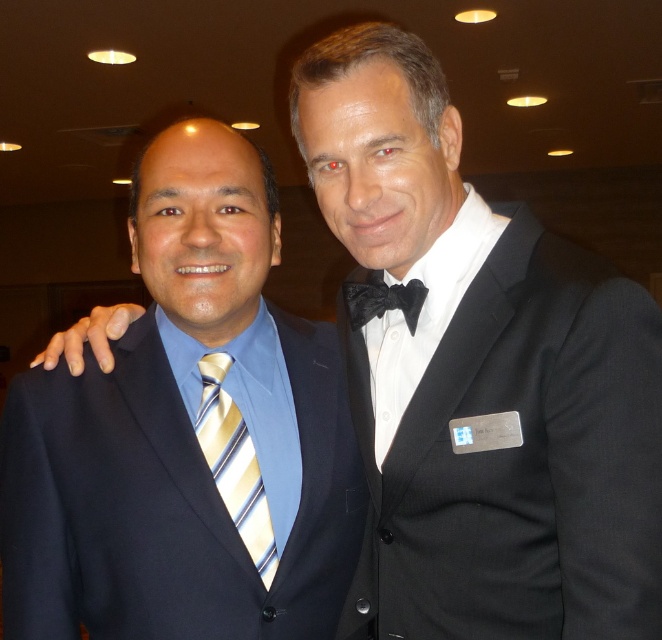
Question: Which of the following is the closest to the observer?

Choices:
 (A) (46, 624)
 (B) (252, 513)
 (C) (638, 426)
 (D) (383, 305)

Answer: (C)

Question: Does black satin bow tie at right appear on the left side of yellow striped tie at left?

Choices:
 (A) yes
 (B) no

Answer: (B)

Question: Which object appears closest to the camera in this image?

Choices:
 (A) yellow striped tie at left
 (B) navy blue suit at left
 (C) black satin bow tie at center

Answer: (B)

Question: Can you confirm if navy blue suit at left is positioned above black satin bow tie at center?

Choices:
 (A) yes
 (B) no

Answer: (B)

Question: Which object appears closest to the camera in this image?

Choices:
 (A) navy blue suit at left
 (B) black satin bow tie at center
 (C) black satin bow tie at right

Answer: (C)

Question: Can you confirm if yellow striped tie at left is positioned below black satin bow tie at center?

Choices:
 (A) no
 (B) yes

Answer: (B)